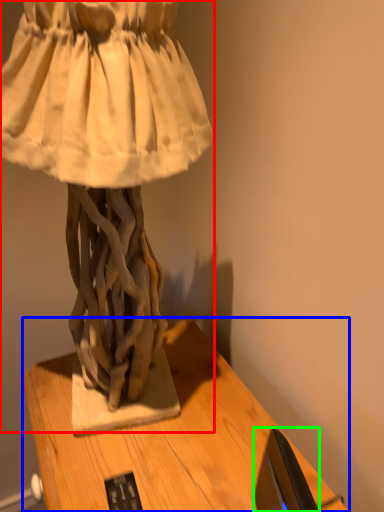
Question: Estimate the real-world distances between objects in this image. Which object is closer to sculpture (highlighted by a red box), table (highlighted by a blue box) or computer monitor (highlighted by a green box)?

Choices:
 (A) table
 (B) computer monitor

Answer: (A)